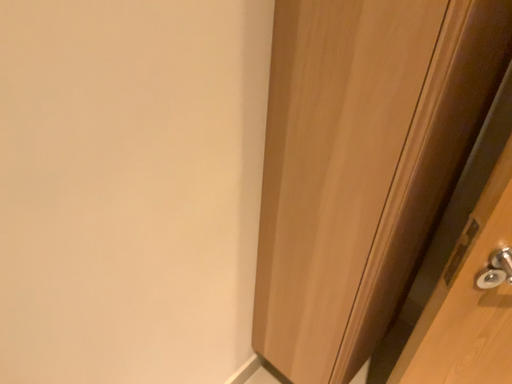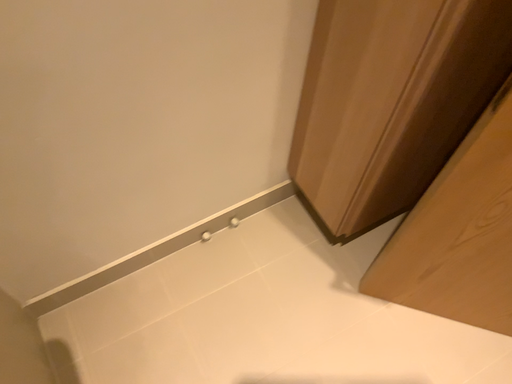
Question: How did the camera likely rotate when shooting the video?

Choices:
 (A) rotated upward
 (B) rotated downward

Answer: (B)